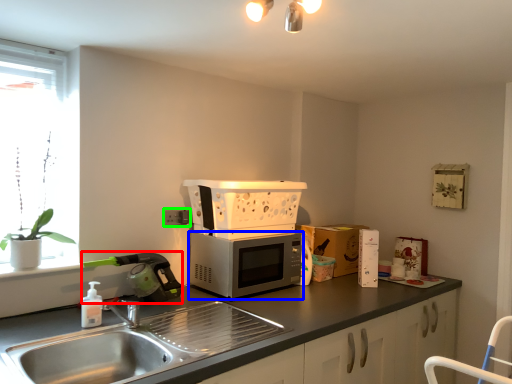
Question: Which is farther away from appliance (highlighted by a red box)? microwave oven (highlighted by a blue box) or electric outlet (highlighted by a green box)?

Choices:
 (A) microwave oven
 (B) electric outlet

Answer: (A)